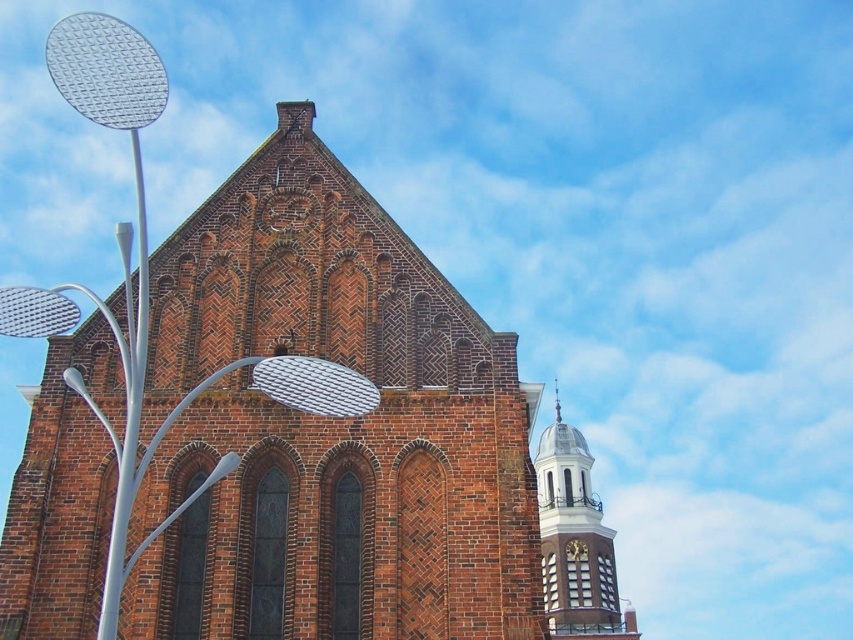
Question: Does white glossy clock tower at upper right have a larger size compared to gold metallic clock at upper right?

Choices:
 (A) yes
 (B) no

Answer: (A)

Question: Is red brick church at center smaller than white glossy clock tower at upper right?

Choices:
 (A) yes
 (B) no

Answer: (A)

Question: Among these points, which one is farthest from the camera?

Choices:
 (A) (616, 616)
 (B) (488, 570)
 (C) (572, 552)

Answer: (A)

Question: Considering the real-world distances, which object is closest to the red brick church at center?

Choices:
 (A) white glossy clock tower at upper right
 (B) gold metallic clock at upper right

Answer: (A)

Question: Which point is farther to the camera?

Choices:
 (A) gold metallic clock at upper right
 (B) red brick church at center

Answer: (A)

Question: Can you confirm if white glossy clock tower at upper right is positioned below gold metallic clock at upper right?

Choices:
 (A) no
 (B) yes

Answer: (A)